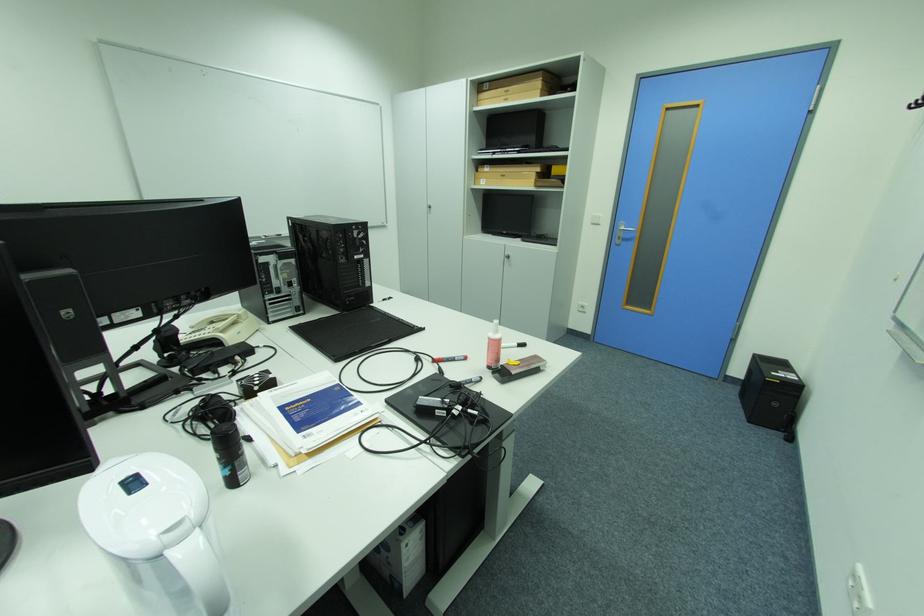
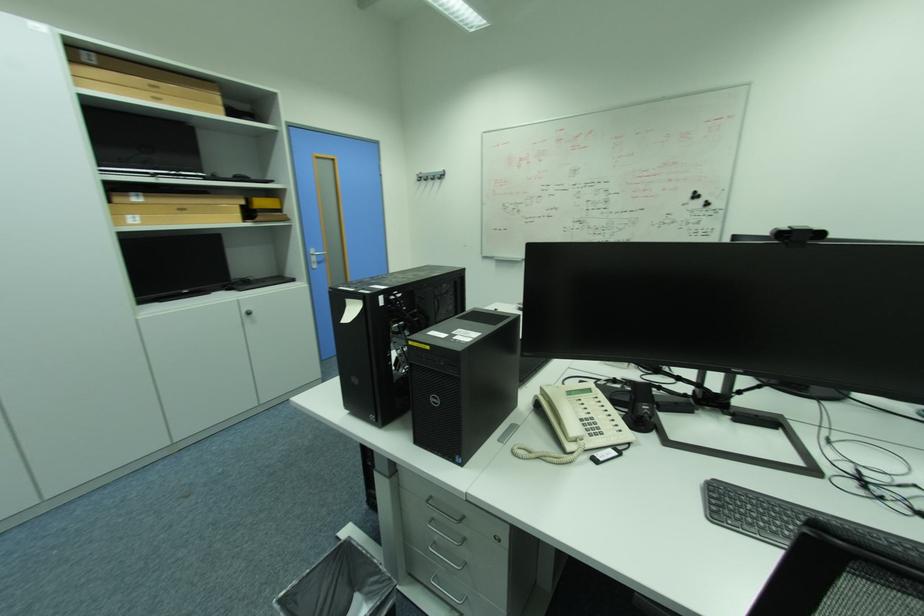
Locate, in the second image, the point that corresponds to (490,180) in the first image.

(136, 217)